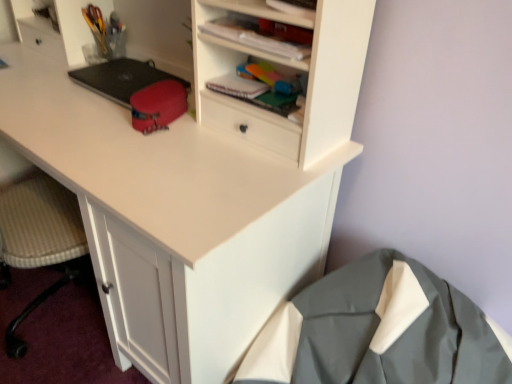
Question: Considering the positions of translucent plastic container at upper left, which appears as the 1th stationery when viewed from the back, and matte white cabinet at upper center in the image, is translucent plastic container at upper left, which appears as the 1th stationery when viewed from the back, bigger or smaller than matte white cabinet at upper center?

Choices:
 (A) small
 (B) big

Answer: (B)

Question: Is point (89, 21) positioned closer to the camera than point (276, 57)?

Choices:
 (A) farther
 (B) closer

Answer: (A)

Question: Estimate the real-world distances between objects in this image. Which object is farther from the matte white cabinet at upper center?

Choices:
 (A) black matte laptop at left
 (B) matte red pouch at center, which ranks as the first stationery in front-to-back order
 (C) gray fabric coat at lower right
 (D) translucent plastic container at upper left, placed as the first stationery when sorted from left to right

Answer: (D)

Question: Estimate the real-world distances between objects in this image. Which object is farther from the gray fabric coat at lower right?

Choices:
 (A) matte red pouch at center, which is the 2th stationery in left-to-right order
 (B) matte white cabinet at upper center
 (C) black matte laptop at left
 (D) translucent plastic container at upper left, placed as the first stationery when sorted from left to right

Answer: (D)